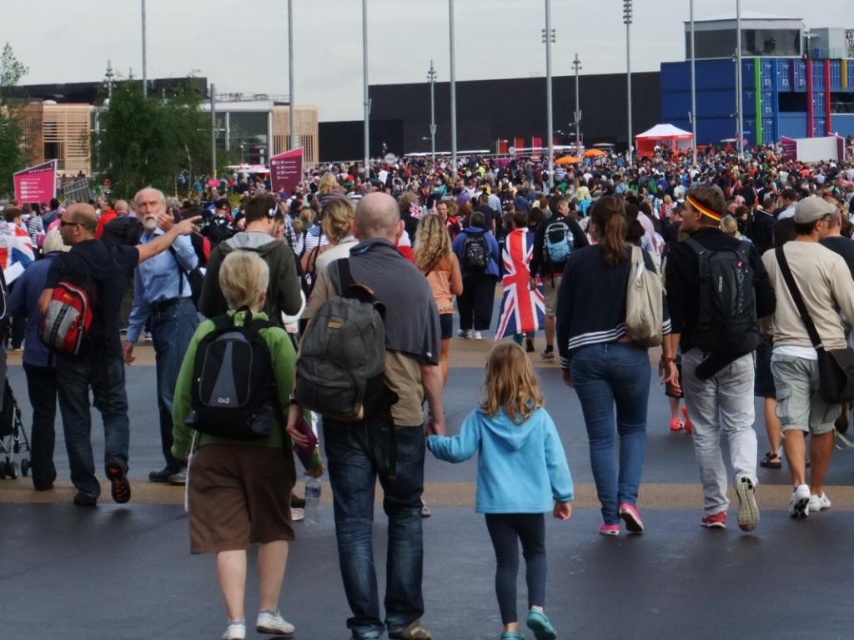
You are a photographer trying to capture a candid shot of the crowd at the event. You notice the dark gray backpack at center and the light blue fleece at center. Which of these two items is more likely to be overlooked in your photo due to its size?

The dark gray backpack at center is smaller than the light blue fleece at center, so it is more likely to be overlooked in the photo due to its smaller size.

Looking at this image, you are standing in the plaza and see the dark gray backpack at center. If you want to reach it quickly, how many steps would you estimate you need to take?

The dark gray backpack at center is 23.40 meters away from viewer. Assuming an average step length of about 0.76 meters, you would need approximately 30 steps to reach it.